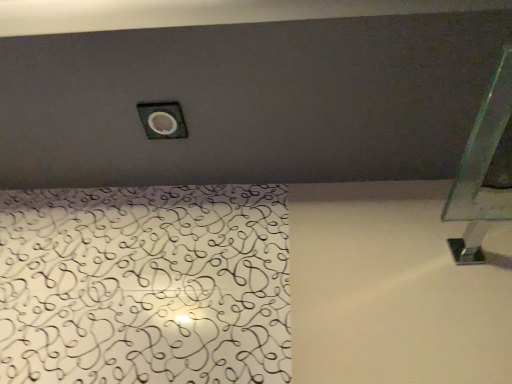
Where is `matte gray wall at upper center`? matte gray wall at upper center is located at coordinates (243, 90).

Describe the element at coordinates (243, 90) in the screenshot. I see `matte gray wall at upper center` at that location.

You are a GUI agent. You are given a task and a screenshot of the screen. Output one action in this format:
    pyautogui.click(x=<x>, y=<y>)
    Task: Click on the matte gray wall at upper center
    The image size is (512, 384).
    Given the screenshot: What is the action you would take?
    pyautogui.click(x=243, y=90)